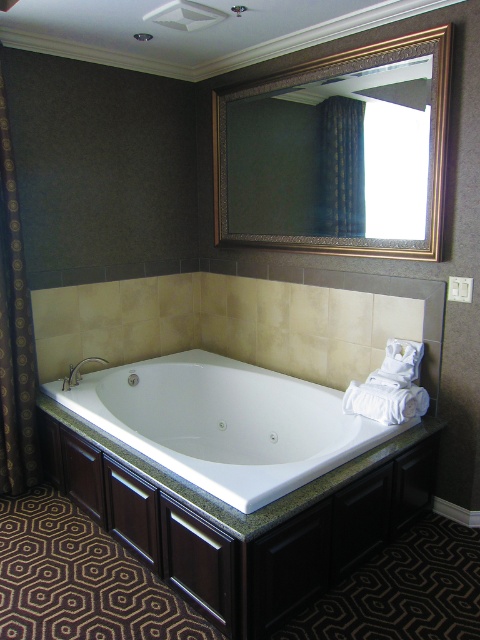
Question: Is the position of white glossy bathtub at center more distant than that of dark blue textured curtain at upper center?

Choices:
 (A) no
 (B) yes

Answer: (A)

Question: Which point is closer to the camera?

Choices:
 (A) gold textured mirror at upper center
 (B) matte silver faucet at lower left
 (C) dark blue textured curtain at upper center
 (D) granite countertop vanity at center

Answer: (D)

Question: Among these objects, which one is farthest from the camera?

Choices:
 (A) gold textured mirror at upper center
 (B) matte silver faucet at lower left
 (C) granite countertop vanity at center
 (D) white glossy bathtub at center

Answer: (B)

Question: Is dark brown textured curtain at left below dark blue textured curtain at upper center?

Choices:
 (A) yes
 (B) no

Answer: (A)

Question: Which object appears farthest from the camera in this image?

Choices:
 (A) white glossy bathtub at center
 (B) gold textured mirror at upper center
 (C) dark brown textured curtain at left

Answer: (C)

Question: Is gold textured mirror at upper center below granite countertop vanity at center?

Choices:
 (A) yes
 (B) no

Answer: (B)